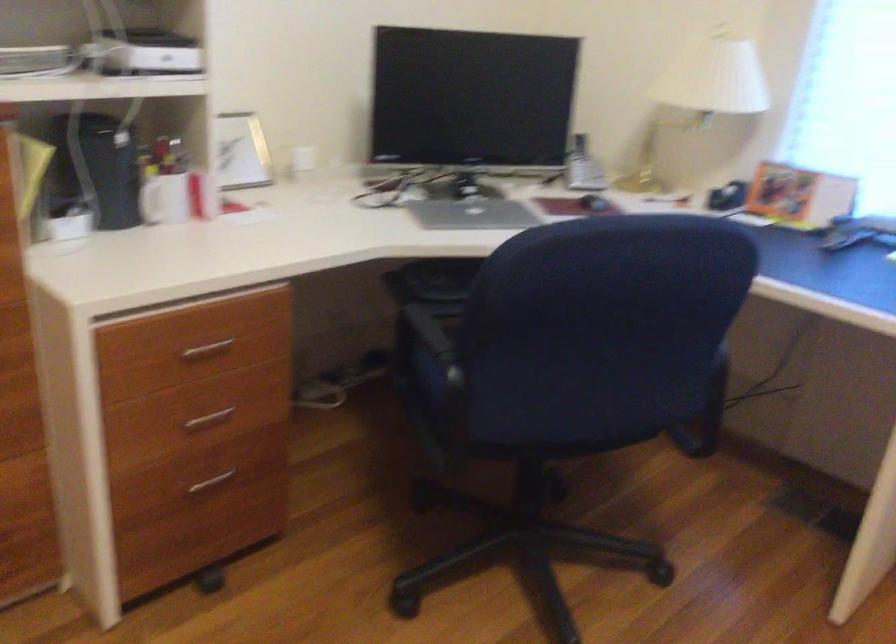
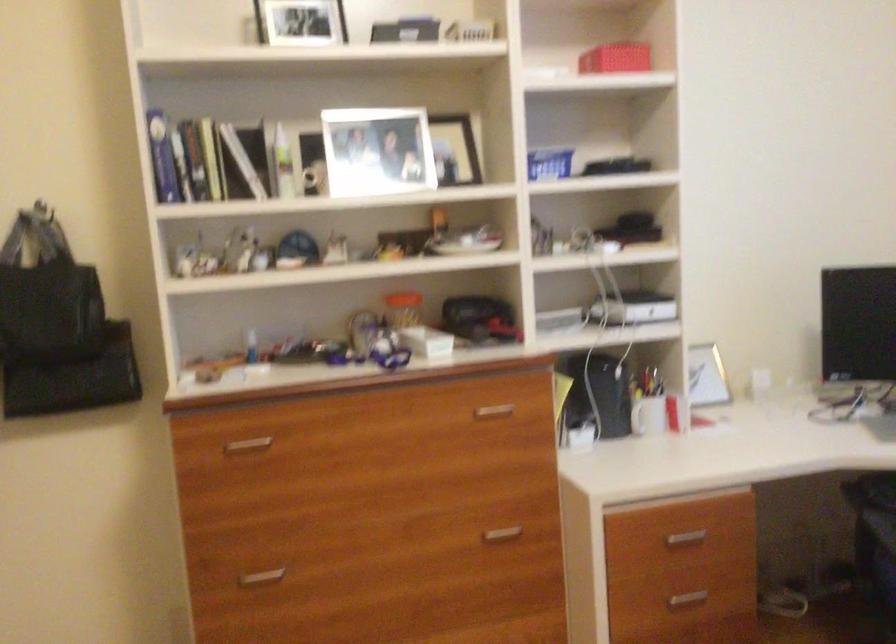
Locate, in the second image, the point that corresponds to point (201, 424) in the first image.

(686, 599)